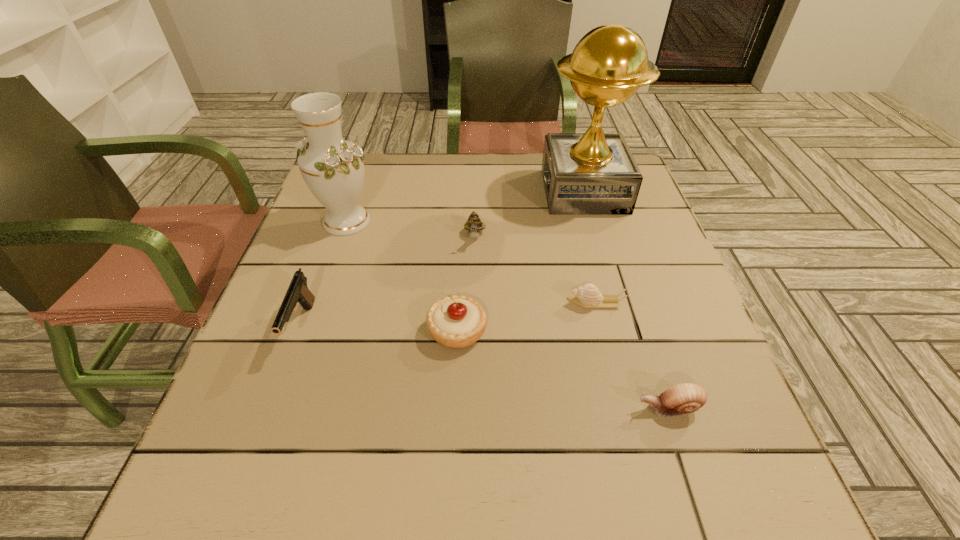
Find the location of a particular element. The width and height of the screenshot is (960, 540). free space that is in between the leftmost escargot and the shortest escargot is located at coordinates (535, 270).

This screenshot has width=960, height=540. Find the location of `free spot between the pastry and the nearest escargot`. free spot between the pastry and the nearest escargot is located at coordinates (563, 369).

The width and height of the screenshot is (960, 540). In order to click on vacant space in between the pistol and the award in this screenshot , I will do `click(443, 259)`.

The height and width of the screenshot is (540, 960). What are the coordinates of `vacant space that is in between the award and the pastry` in the screenshot? It's located at pyautogui.click(x=520, y=261).

The width and height of the screenshot is (960, 540). I want to click on object that is the sixth nearest to the pistol, so click(684, 398).

Where is `object that stands as the second closest to the shortest object`? The height and width of the screenshot is (540, 960). object that stands as the second closest to the shortest object is located at coordinates tap(684, 398).

Choose which escargot is the third nearest neighbor to the tallest object. Please provide its 2D coordinates. Your answer should be formatted as a tuple, i.e. [(x, y)], where the tuple contains the x and y coordinates of a point satisfying the conditions above.

[(684, 398)]

Locate an element on the screen. This screenshot has height=540, width=960. the closest escargot to the vase is located at coordinates (473, 225).